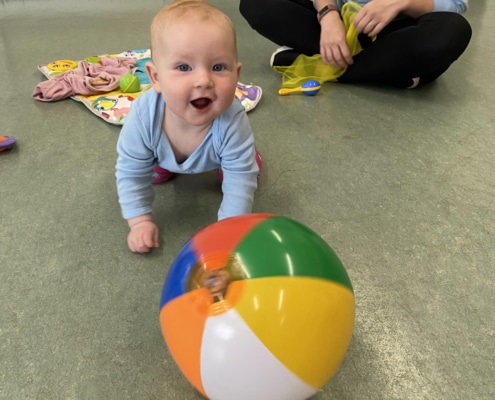
Locate an element on the screen. Image resolution: width=495 pixels, height=400 pixels. toy is located at coordinates (307, 88).